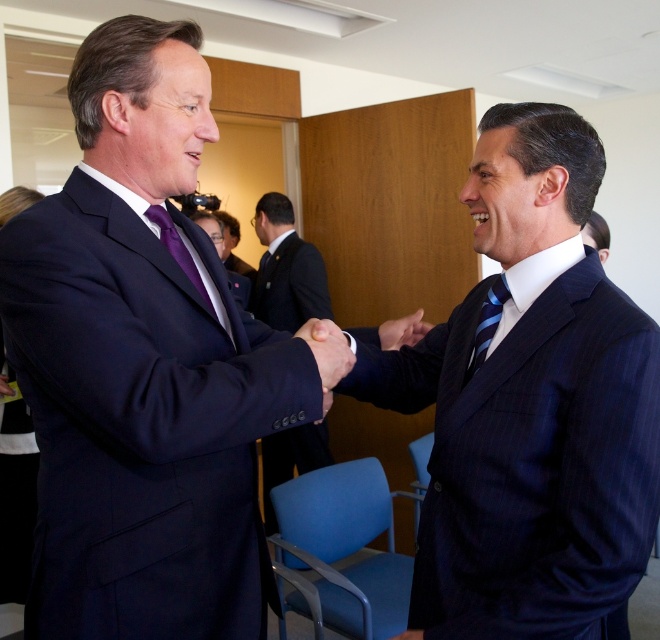
Question: Can you confirm if purple silk tie at left is positioned to the left of matte black suit at right?

Choices:
 (A) yes
 (B) no

Answer: (A)

Question: Can you confirm if dark blue suit at center is positioned to the left of smooth skin handshake at center?

Choices:
 (A) yes
 (B) no

Answer: (A)

Question: Among these points, which one is farthest from the camera?

Choices:
 (A) (331, 346)
 (B) (605, 246)
 (C) (24, 225)
 (D) (558, 312)

Answer: (B)

Question: Which point is farther to the camera?

Choices:
 (A) (490, 330)
 (B) (346, 368)
 (C) (562, 291)
 (D) (591, 236)

Answer: (D)

Question: Which of the following is the farthest from the observer?

Choices:
 (A) (36, 572)
 (B) (383, 349)

Answer: (B)

Question: Can you confirm if navy pinstripe suit at center is positioned to the left of smooth skin handshake at center?

Choices:
 (A) no
 (B) yes

Answer: (B)